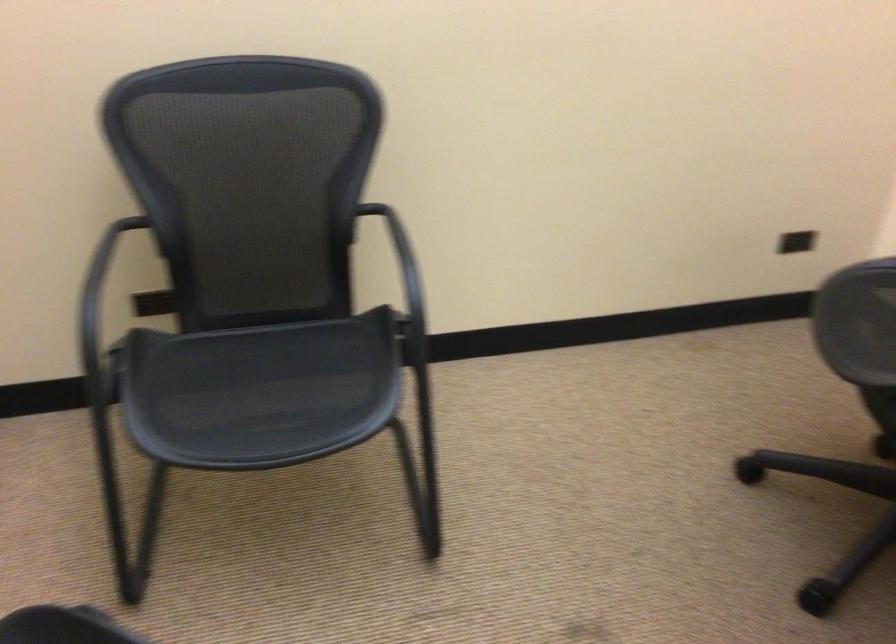
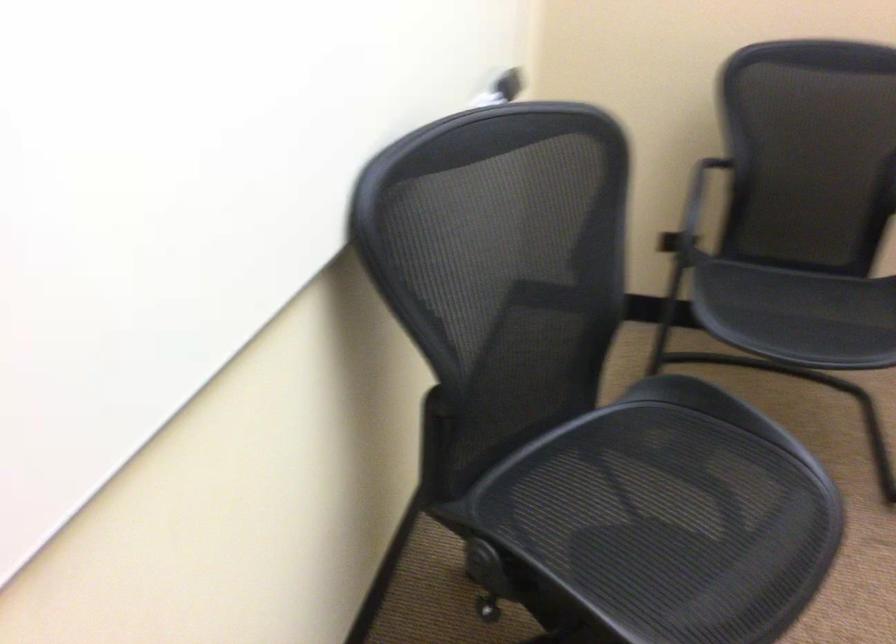
The images are taken continuously from a first-person perspective. In which direction are you moving?

The cameraman moved toward left, backward.